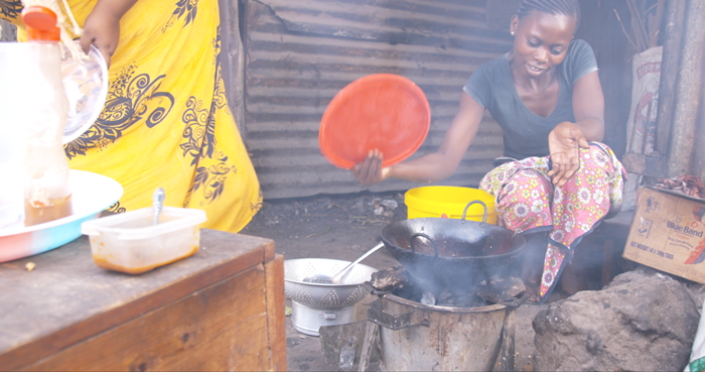
You are a GUI agent. You are given a task and a screenshot of the screen. Output one action in this format:
    pyautogui.click(x=<x>, y=<y>)
    Task: Click on the pan's handles
    This screenshot has width=705, height=372.
    Given the screenshot: What is the action you would take?
    pyautogui.click(x=431, y=250), pyautogui.click(x=484, y=212)